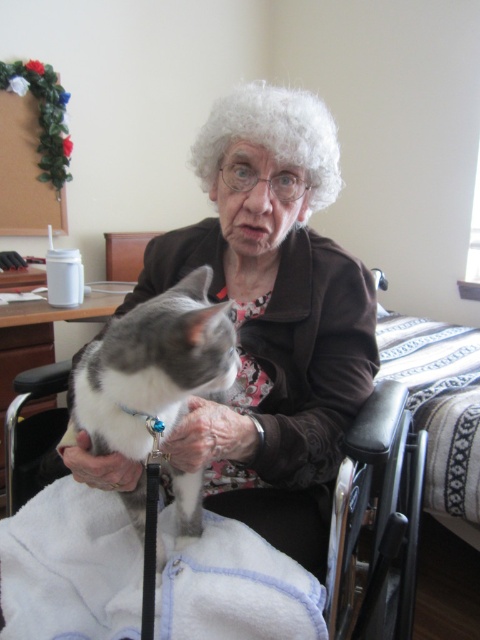
Question: Which is nearer to the white curly wig at center?

Choices:
 (A) gray fur cat at center
 (B) black plastic wheelchair at center
 (C) matte brown jacket at center

Answer: (C)

Question: Is black plastic wheelchair at center thinner than white curly wig at center?

Choices:
 (A) no
 (B) yes

Answer: (A)

Question: Where is matte brown jacket at center located in relation to gray fur cat at center in the image?

Choices:
 (A) above
 (B) below

Answer: (A)

Question: Which of the following is the closest to the observer?

Choices:
 (A) (219, 355)
 (B) (239, 129)

Answer: (A)

Question: Estimate the real-world distances between objects in this image. Which object is closer to the gray fur cat at center?

Choices:
 (A) black plastic wheelchair at center
 (B) white curly wig at center
 (C) matte brown jacket at center

Answer: (C)

Question: Can you confirm if matte brown jacket at center is wider than black plastic wheelchair at center?

Choices:
 (A) yes
 (B) no

Answer: (B)